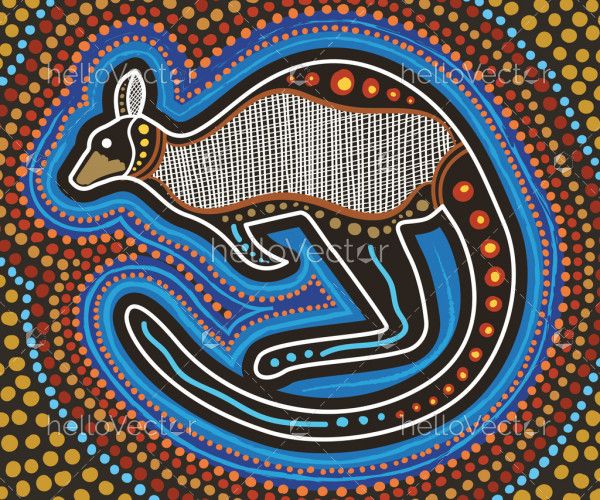
What are the coordinates of `aboriginal art` in the screenshot? It's located at (357, 182).